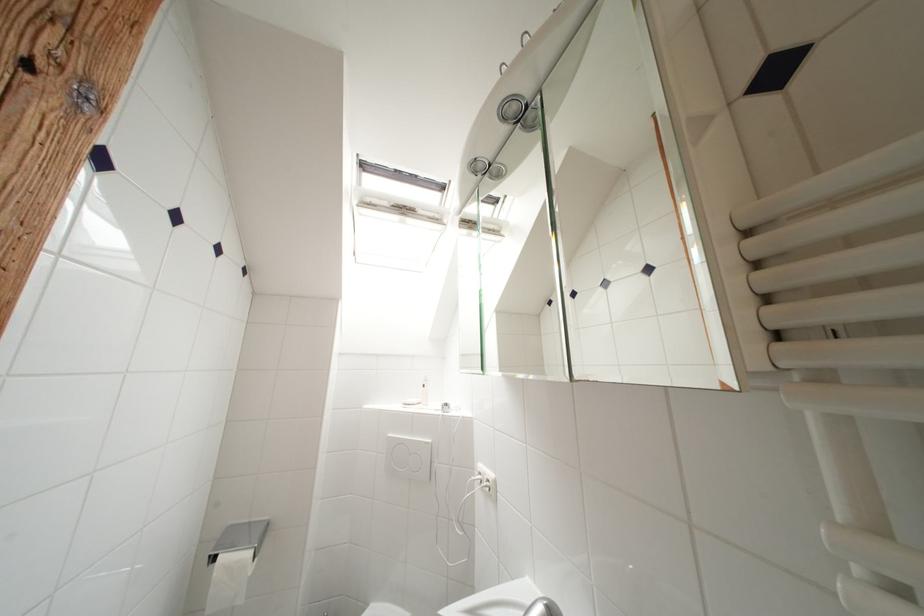
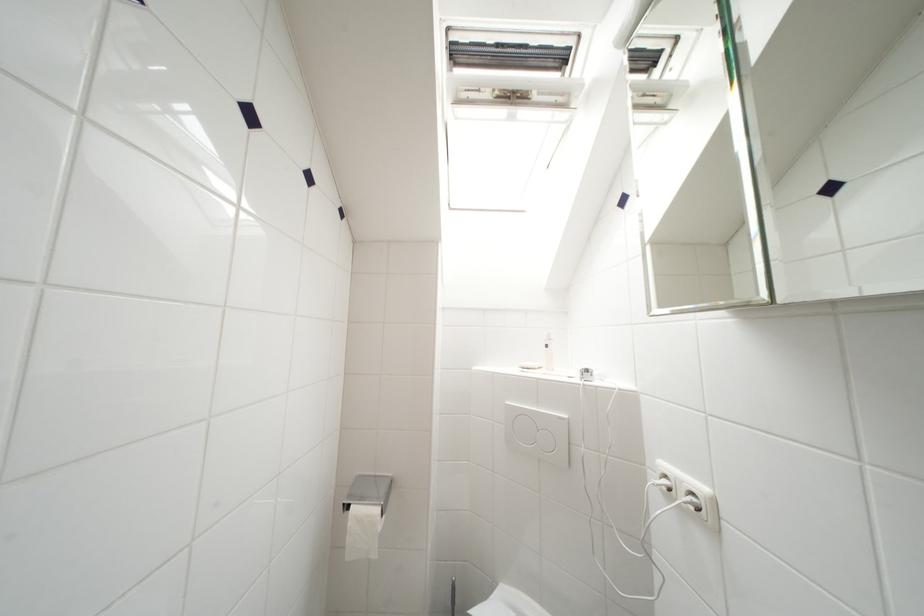
Find the pixel in the second image that matches point 220,562 in the first image.

(354, 512)